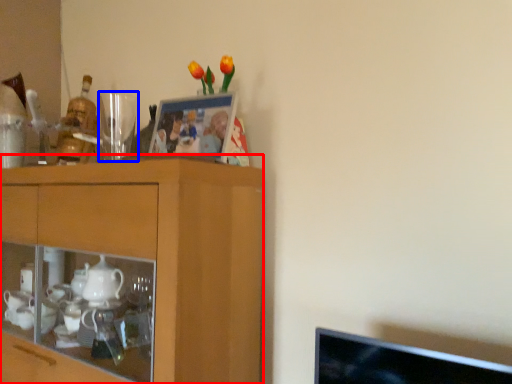
Question: Which of the following is the closest to the observer, cabinetry (highlighted by a red box) or tableware (highlighted by a blue box)?

Choices:
 (A) cabinetry
 (B) tableware

Answer: (A)